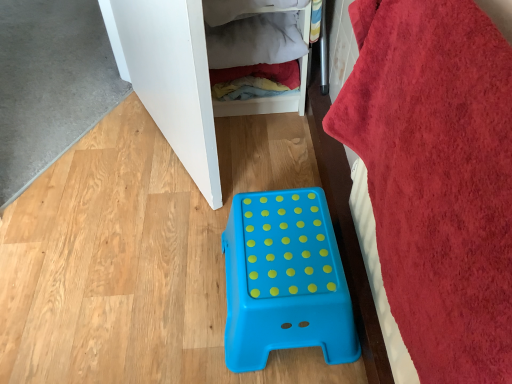
At what (x,y) coordinates should I click in order to perform the action: click on empty space that is ontop of blue plastic step stool at center, the first furniture when ordered from bottom to top. Please return your answer as a coordinate pair (x, y). Image resolution: width=512 pixels, height=384 pixels. Looking at the image, I should click on (282, 245).